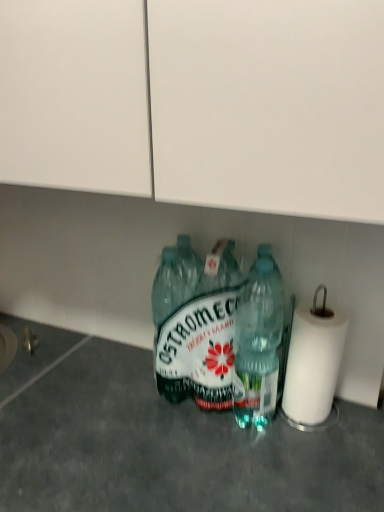
Question: Considering their positions, is translucent plastic bottle at center, the first bottle from the right, located in front of or behind white paper at right?

Choices:
 (A) behind
 (B) front

Answer: (B)

Question: Choose the correct answer: Is translucent plastic bottle at center, acting as the 2th bottle starting from the left, inside white paper at right or outside it?

Choices:
 (A) inside
 (B) outside

Answer: (B)

Question: Which of these objects is positioned farthest from the green plastic bottle at center, which ranks as the second bottle in right-to-left order?

Choices:
 (A) white paper at right
 (B) transparent plastic bottles at center
 (C) translucent plastic bottle at center, the first bottle from the right

Answer: (B)

Question: Which object is the closest to the translucent plastic bottle at center, acting as the 2th bottle starting from the left?

Choices:
 (A) green plastic bottle at center, which appears as the first bottle when viewed from the left
 (B) white paper at right
 (C) transparent plastic bottles at center

Answer: (A)